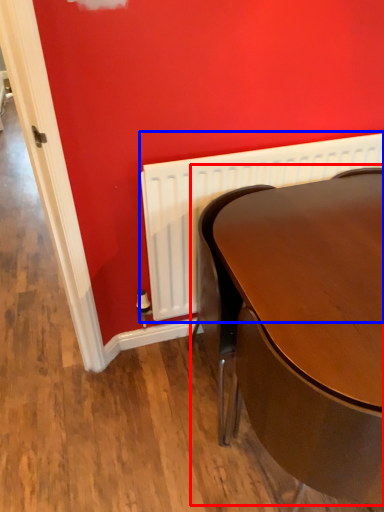
Question: Which of the following is the farthest to the observer, table (highlighted by a red box) or radiator (highlighted by a blue box)?

Choices:
 (A) table
 (B) radiator

Answer: (B)